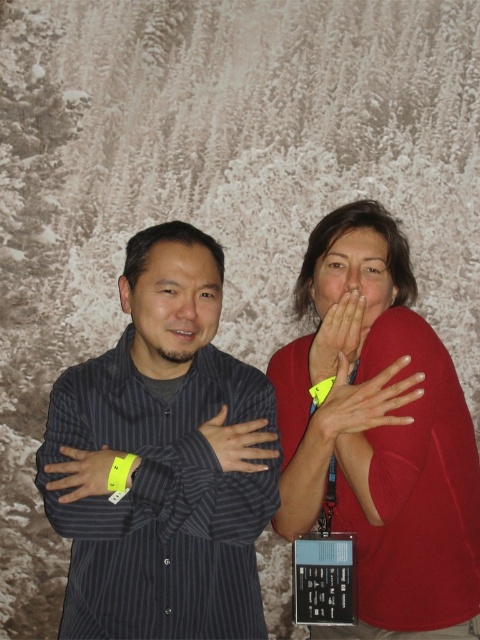
Based on the photo, you are a photographer adjusting the lighting for a portrait. You notice two yellow items in the frame. The yellow fabric wristband at center and the yellow fabric hand at center. Which of these two items is closer to the camera?

The yellow fabric wristband at center is closer to the camera than the yellow fabric hand at center because the distance between them is 3.72 inches, meaning the wristband is in front of the hand.

You are a photographer setting up a photo shoot with two people. The scene has a snowy forest backdrop. You need to place a yellow fabric wristband at center. Where exactly should you position it?

The yellow fabric wristband at center should be placed at point (x=364, y=401).